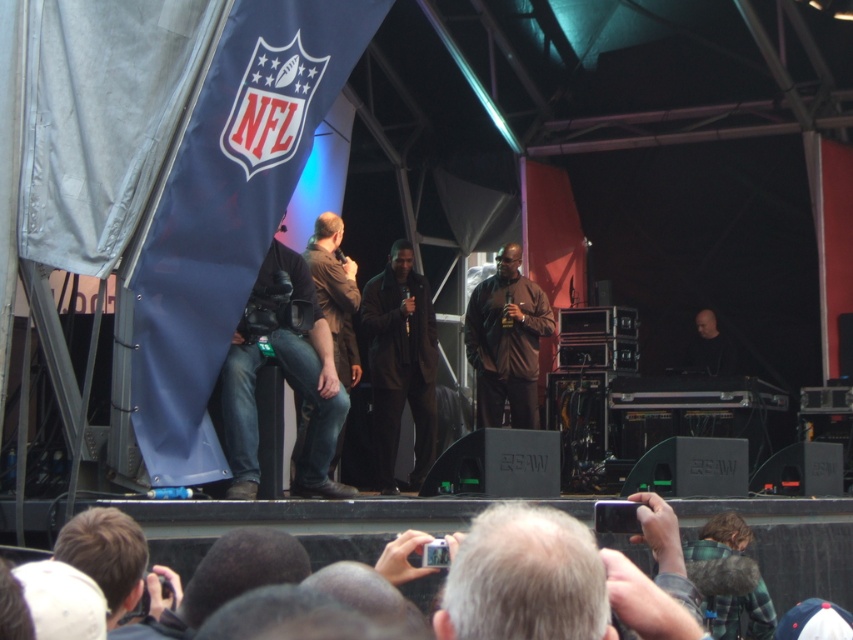
Is black leather jacket at center further to the viewer compared to dark brown leather jacket at center?

No, black leather jacket at center is closer to the viewer.

Image resolution: width=853 pixels, height=640 pixels. I want to click on black leather jacket at center, so click(x=306, y=371).

Between brown matte jacket at center and brown leather jacket at center, which one appears on the right side from the viewer's perspective?

Positioned to the right is brown matte jacket at center.

Between brown matte jacket at center and brown leather jacket at center, which one appears on the left side from the viewer's perspective?

brown leather jacket at center is more to the left.

Is point (552, 320) less distant than point (346, 301)?

No, (552, 320) is behind (346, 301).

The image size is (853, 640). I want to click on brown matte jacket at center, so click(x=506, y=340).

Can you confirm if black leather jacket at center is bigger than brown leather jacket at center?

Yes, black leather jacket at center is bigger than brown leather jacket at center.

Does black leather jacket at center come in front of brown leather jacket at center?

That is True.

Is point (328, 444) behind point (345, 308)?

That is False.

Locate an element on the screen. black leather jacket at center is located at coordinates (306, 371).